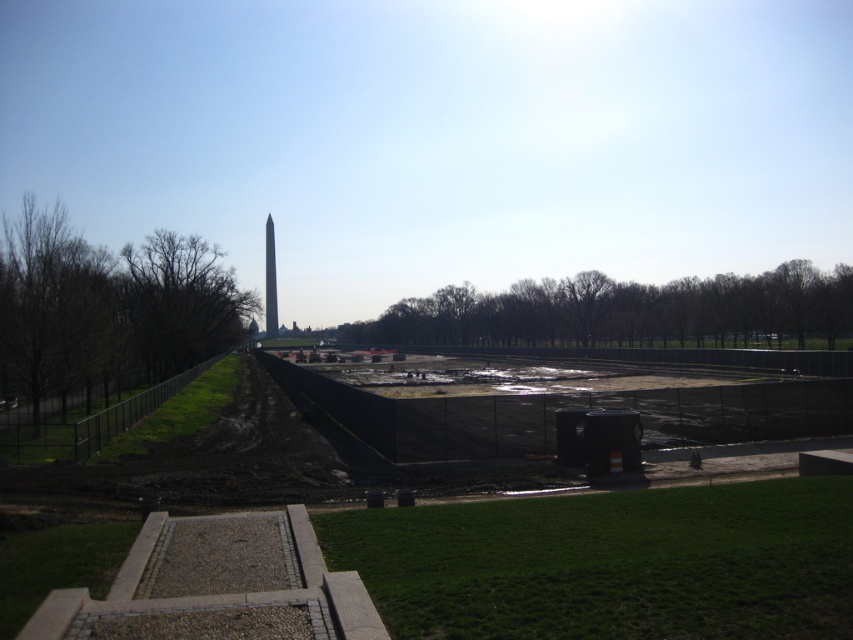
Which is above, black matte construction site at center or polished granite obelisk at center?

Positioned higher is polished granite obelisk at center.

Does black matte construction site at center have a lesser width compared to polished granite obelisk at center?

Incorrect, black matte construction site at center's width is not less than polished granite obelisk at center's.

Is point (839, 436) in front of point (265, 269)?

Yes, point (839, 436) is in front of point (265, 269).

In order to click on black matte construction site at center in this screenshot , I will do `click(202, 480)`.